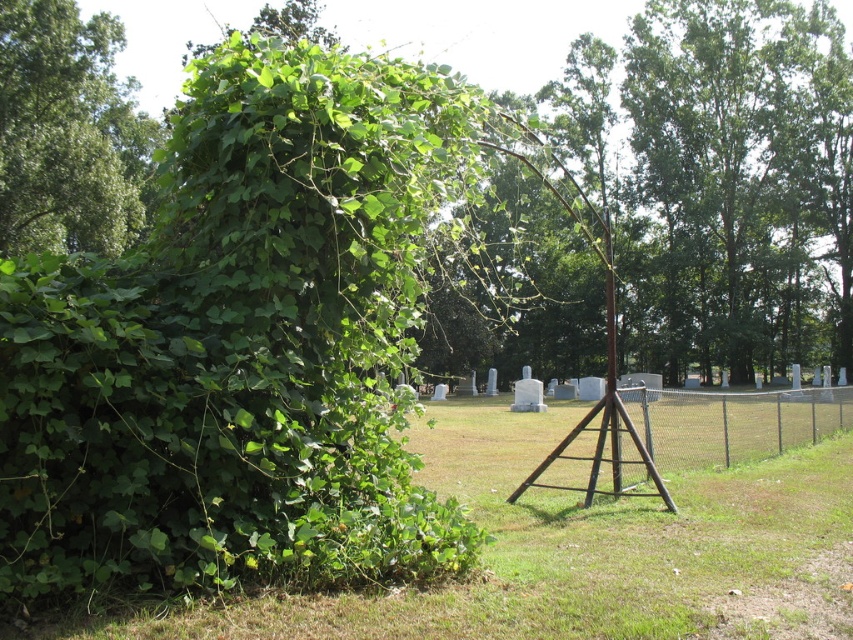
You are standing in the cemetery scene and want to place a small decoration exactly at the point marked as point (x=746, y=172). According to the scene description, where on the image would this point be located?

The point (x=746, y=172) is located on the green leafy tree at upper right.

You are a photographer setting up a tripod in this outdoor scene. You want to capture both the green leafy tree at upper right and the green leafy tree at left in your shot. Given their sizes, which tree should you focus on to ensure both are visible in the frame?

The green leafy tree at upper right is larger than the green leafy tree at left, so you should focus on the larger tree to ensure both are visible in the frame.

You are standing at the point marked by the coordinates point (585, 548) in the image. What is the terrain like at that location?

The point (585, 548) corresponds to green grass at center, so the terrain at that location is grassy.